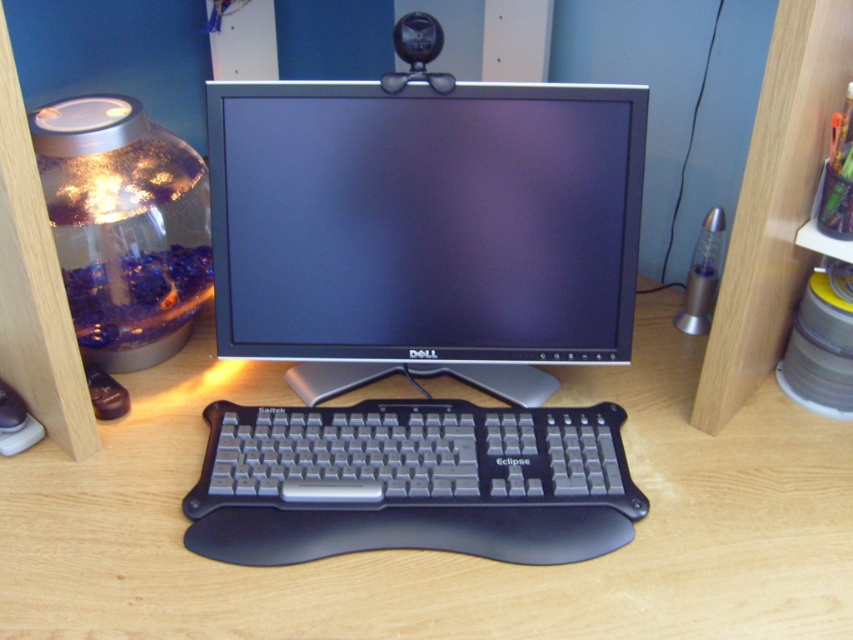
Question: Which of the following is the closest to the observer?

Choices:
 (A) (368, 540)
 (B) (148, 529)
 (C) (624, 232)

Answer: (A)

Question: Is black plastic keyboard at center below satin black keyboard at center?

Choices:
 (A) yes
 (B) no

Answer: (B)

Question: Considering the relative positions of satin black monitor at center and satin black keyboard at center in the image provided, where is satin black monitor at center located with respect to satin black keyboard at center?

Choices:
 (A) left
 (B) right

Answer: (B)

Question: Which point is closer to the camera?

Choices:
 (A) (553, 493)
 (B) (520, 368)
 (C) (732, 525)

Answer: (C)

Question: Where is black plastic keyboard at center located in relation to satin black monitor at center in the image?

Choices:
 (A) below
 (B) above

Answer: (A)

Question: Estimate the real-world distances between objects in this image. Which object is farther from the satin black monitor at center?

Choices:
 (A) black plastic keyboard at center
 (B) satin black keyboard at center

Answer: (A)